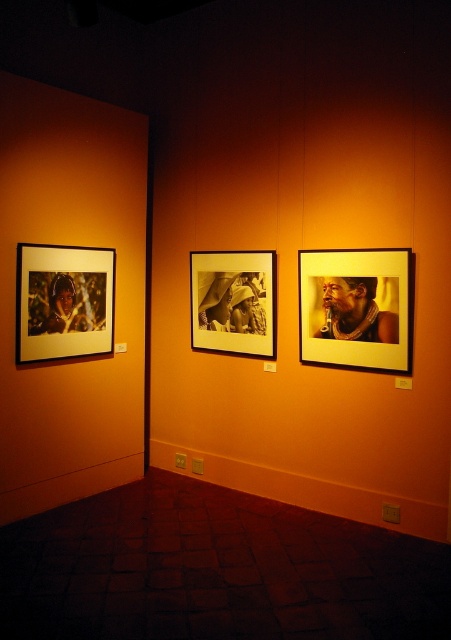
Between matte glass photo frame at left and wooden frame at center, which one has less height?

wooden frame at center is shorter.

Which is in front, point (84, 344) or point (211, 296)?

Point (84, 344) is in front.

Image resolution: width=451 pixels, height=640 pixels. What are the coordinates of `matte glass photo frame at left` in the screenshot? It's located at (64, 301).

Is matte glass photo frame at center right behind wooden frame at center?

That is False.

Does matte glass photo frame at center right have a larger size compared to wooden frame at center?

Incorrect, matte glass photo frame at center right is not larger than wooden frame at center.

Does point (401, 355) come in front of point (247, 332)?

Yes, it is.

Identify the location of matte glass photo frame at center right. The image size is (451, 640). (355, 307).

Who is taller, matte glass photo frame at center right or matte glass photo frame at left?

matte glass photo frame at left is taller.

Between point (326, 250) and point (23, 282), which one is positioned behind?

Positioned behind is point (326, 250).

The width and height of the screenshot is (451, 640). Find the location of `matte glass photo frame at center right`. matte glass photo frame at center right is located at coordinates (355, 307).